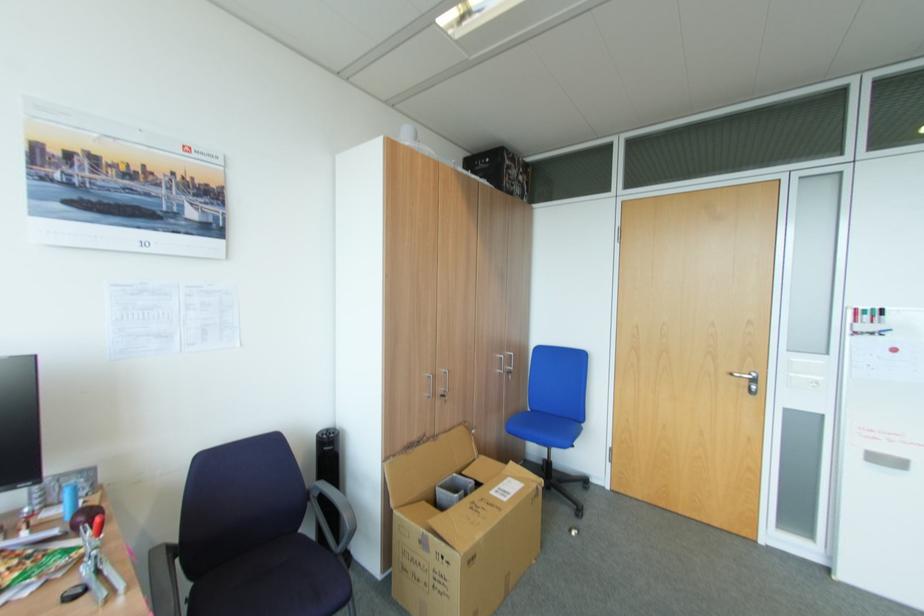
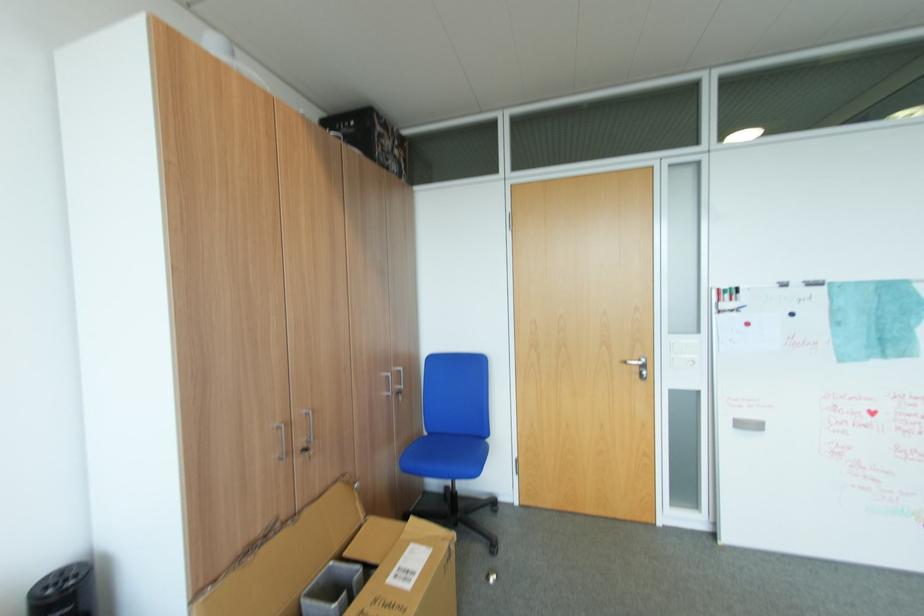
In the second image, find the point that corresponds to (504,370) in the first image.

(390, 394)